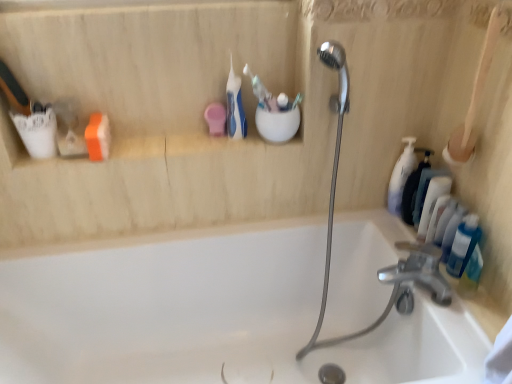
Image resolution: width=512 pixels, height=384 pixels. I want to click on vacant space to the left of white matte pump bottle at right, which is counted as the 5th toiletry, starting from the right, so click(x=357, y=220).